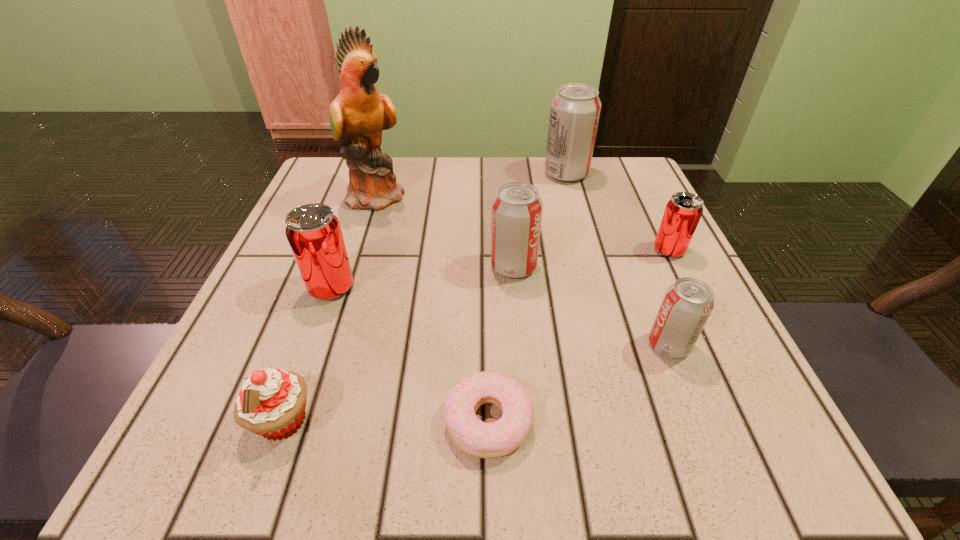
Find the location of a particular element. The height and width of the screenshot is (540, 960). the smallest gray soda can is located at coordinates (687, 304).

Where is `the sixth farthest object`? the sixth farthest object is located at coordinates (687, 304).

Locate an element on the screen. The height and width of the screenshot is (540, 960). cupcake is located at coordinates (272, 402).

This screenshot has height=540, width=960. Identify the location of the shortest object. [474, 437].

This screenshot has width=960, height=540. Find the location of `pink doughnut`. pink doughnut is located at coordinates (474, 437).

Identify the location of free location located 0.160m on the front-facing side of the green parrot. click(x=481, y=195).

Where is `vacant space located 0.120m on the right of the farthest soda can`? This screenshot has height=540, width=960. vacant space located 0.120m on the right of the farthest soda can is located at coordinates (639, 174).

Where is `free space located 0.230m on the left of the second nearest gray soda can`? free space located 0.230m on the left of the second nearest gray soda can is located at coordinates (363, 266).

Image resolution: width=960 pixels, height=540 pixels. I want to click on free point located 0.080m on the back of the nearer red soda can, so click(x=347, y=244).

You are a GUI agent. You are given a task and a screenshot of the screen. Output one action in this format:
    pyautogui.click(x=<x>, y=<y>)
    Task: Click on the vacant point located on the back of the rightmost object
    
    Given the screenshot: What is the action you would take?
    click(637, 186)